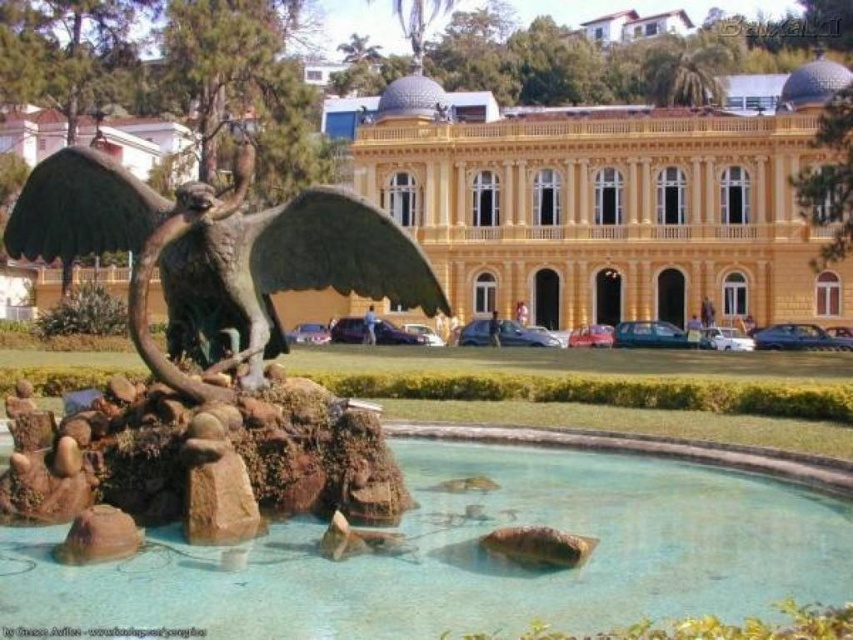
Which is behind, point (379, 140) or point (180, 349)?

The point (379, 140) is more distant.

Who is positioned more to the left, yellow matte building at center or bronze/golden statue at center?

bronze/golden statue at center is more to the left.

Is point (579, 124) behind point (68, 202)?

Yes, point (579, 124) is behind point (68, 202).

The image size is (853, 640). What are the coordinates of `yellow matte building at center` in the screenshot? It's located at (611, 205).

Which of these two, clear glass pond at center or bronze/golden statue at center, stands taller?

With more height is bronze/golden statue at center.

Between clear glass pond at center and bronze/golden statue at center, which one appears on the left side from the viewer's perspective?

From the viewer's perspective, bronze/golden statue at center appears more on the left side.

Does point (270, 609) come farther from viewer compared to point (263, 316)?

No, it is in front of (263, 316).

In order to click on clear glass pond at center in this screenshot , I will do `click(477, 554)`.

Is clear glass pond at center to the left of yellow matte building at center from the viewer's perspective?

Indeed, clear glass pond at center is positioned on the left side of yellow matte building at center.

Which is behind, point (432, 493) or point (585, 115)?

Point (585, 115)

Is point (189, 550) closer to viewer compared to point (438, 252)?

Yes.

You are a GUI agent. You are given a task and a screenshot of the screen. Output one action in this format:
    pyautogui.click(x=<x>, y=<y>)
    Task: Click on the clear glass pond at center
    
    Given the screenshot: What is the action you would take?
    pyautogui.click(x=477, y=554)